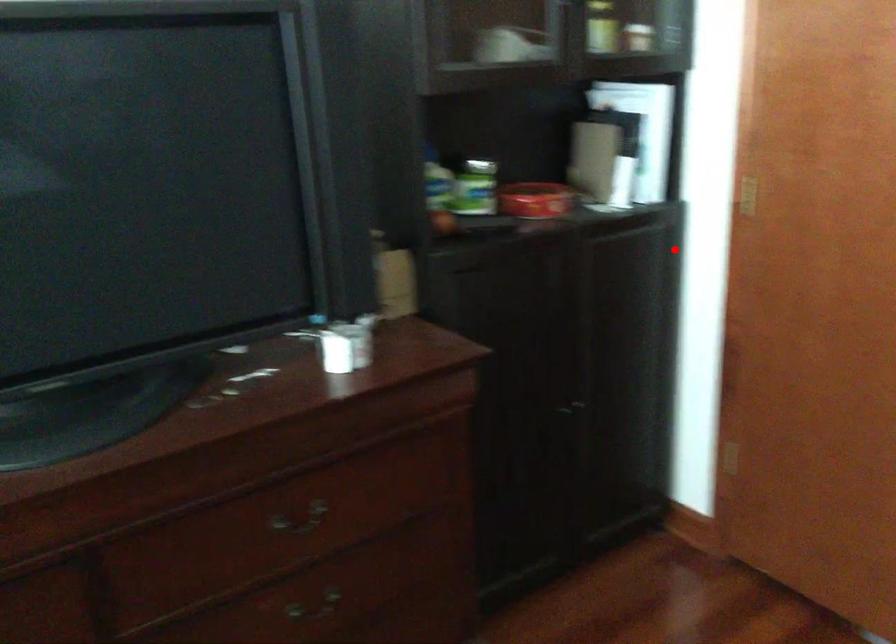
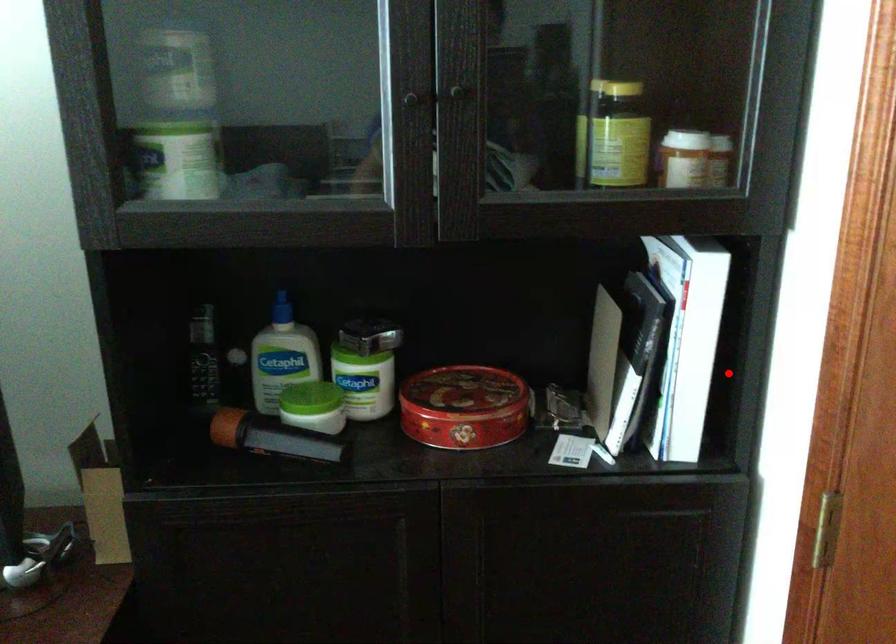
I am providing you with two images of the same scene from different viewpoints. A red point is marked on the first image and another point is marked on the second image. Is the red point in image1 aligned with the point shown in image2?

No